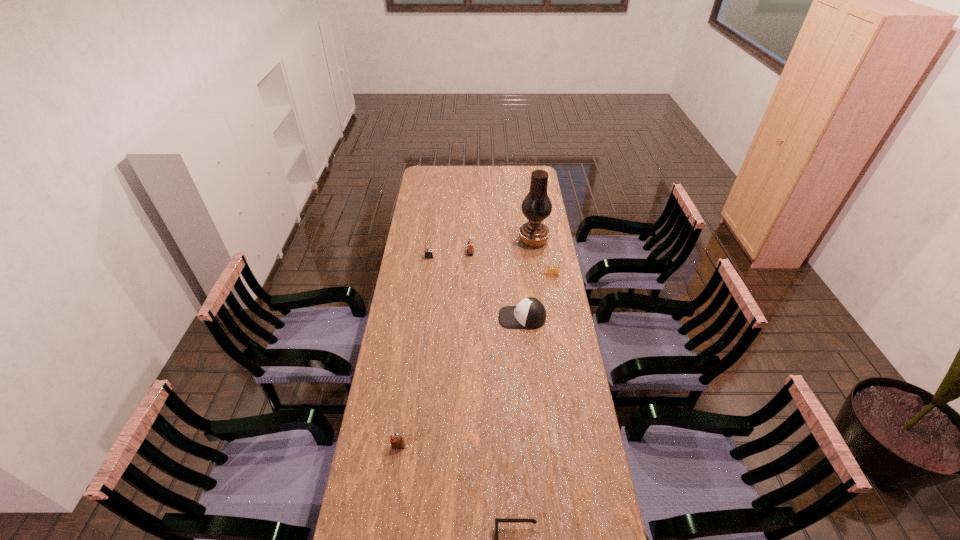
Identify the location of vacant space located 0.060m on the front panel of the fifth farthest object. (485, 318).

Where is `vacant area situated 0.100m on the front panel of the fifth farthest object`? Image resolution: width=960 pixels, height=540 pixels. vacant area situated 0.100m on the front panel of the fifth farthest object is located at coordinates (475, 318).

The image size is (960, 540). I want to click on free space located on the front panel of the fifth farthest object, so click(451, 318).

Where is `vacant space located on the front-facing side of the nearest padlock`? vacant space located on the front-facing side of the nearest padlock is located at coordinates (386, 535).

At what (x,y) coordinates should I click in order to perform the action: click on oil lamp situated at the right edge. Please return your answer as a coordinate pair (x, y). Looking at the image, I should click on (536, 206).

The height and width of the screenshot is (540, 960). What are the coordinates of `padlock located at the right edge` in the screenshot? It's located at (551, 270).

The image size is (960, 540). What are the coordinates of `cap that is at the right edge` in the screenshot? It's located at (529, 313).

The height and width of the screenshot is (540, 960). In order to click on blank space at the far edge in this screenshot , I will do `click(477, 176)`.

The height and width of the screenshot is (540, 960). Identify the location of vacant region at the left edge of the desktop. (430, 235).

Where is `vacant area at the right edge of the desktop`? This screenshot has height=540, width=960. vacant area at the right edge of the desktop is located at coordinates (587, 492).